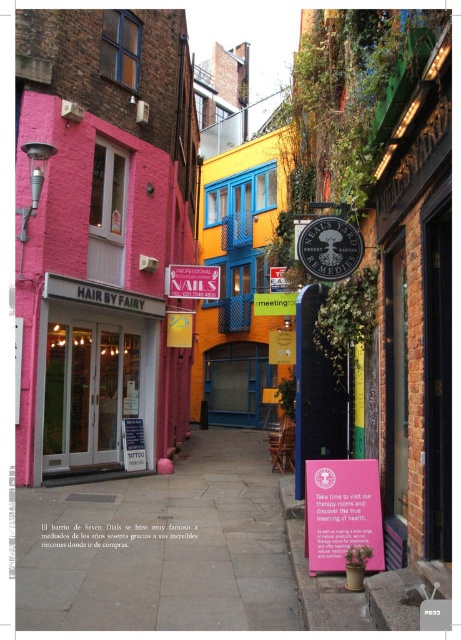
You are a delivery person trying to find the entrance to the tattoo shop in the alley. You see the smooth concrete pavement at center and the matte white door at center. Which object is closer to the ground?

The smooth concrete pavement at center is below matte white door at center, so the smooth concrete pavement at center is closer to the ground.

You are a delivery person trying to park your bike in the alleyway. The bike requires a space larger than the matte white door at center. Is there enough space on the smooth concrete pavement at center for your bike?

The smooth concrete pavement at center is bigger than the matte white door at center, so yes, there is enough space on the smooth concrete pavement at center to park the bike.